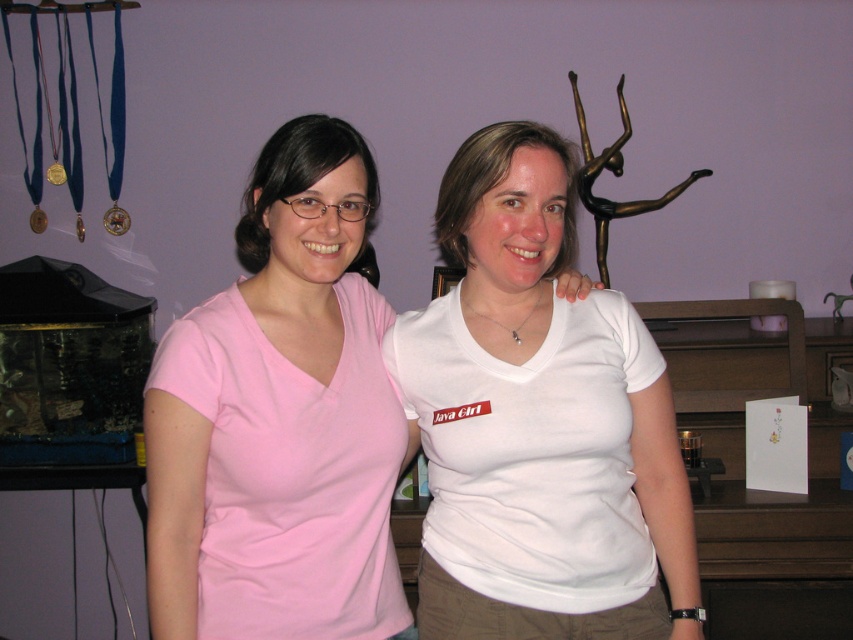
You are a photographer adjusting your camera settings. You notice two points in the image at coordinates point (610, 312) and point (222, 304). Which point is closer to the camera lens?

Point (610, 312) is further to the camera than point (222, 304), so the point closer to the camera lens is point (222, 304).